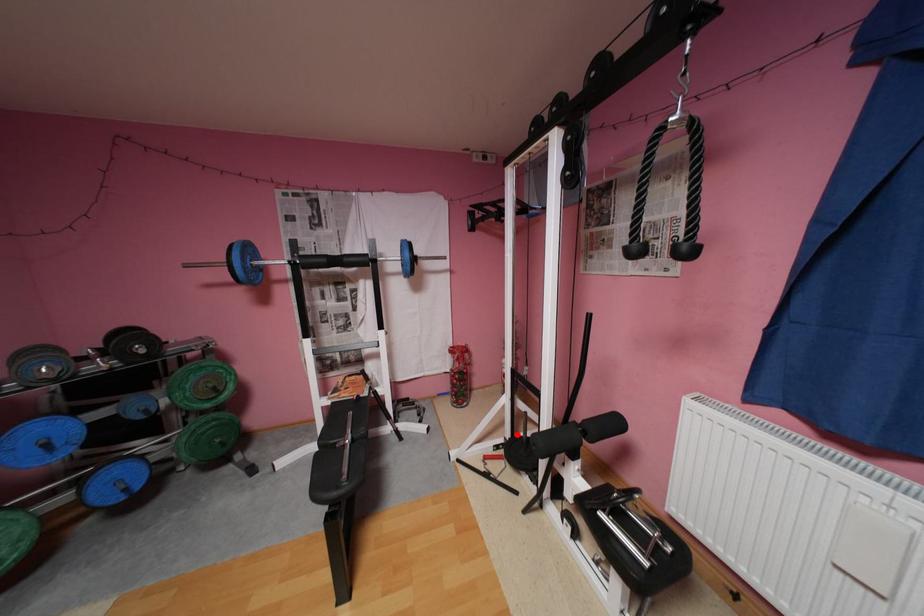
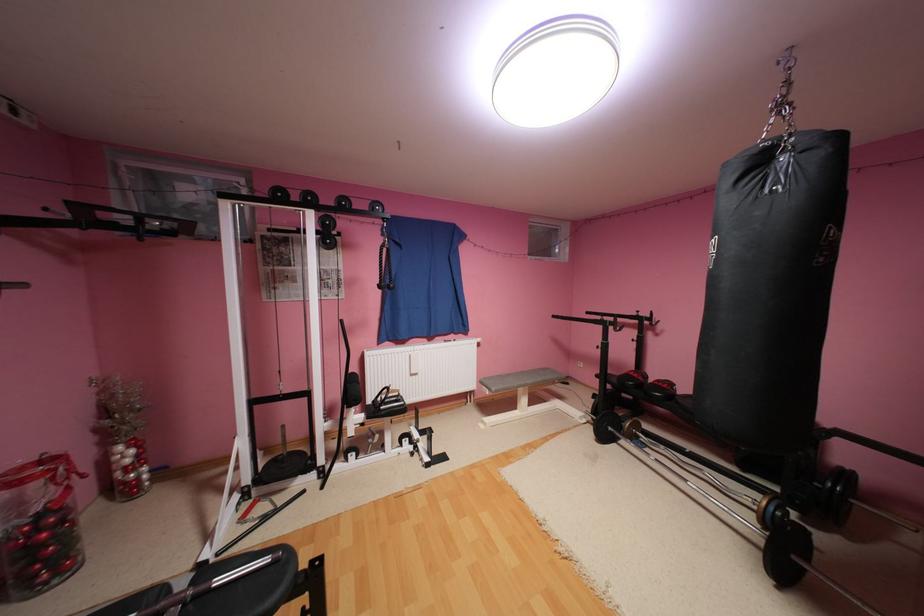
In the second image, find the point that corresponds to the highlighted location in the first image.

(256, 479)